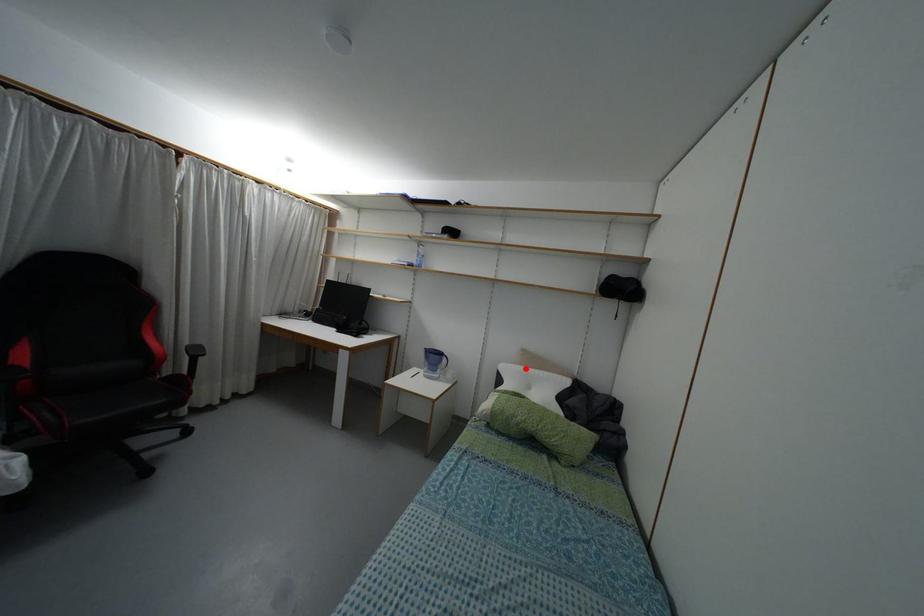
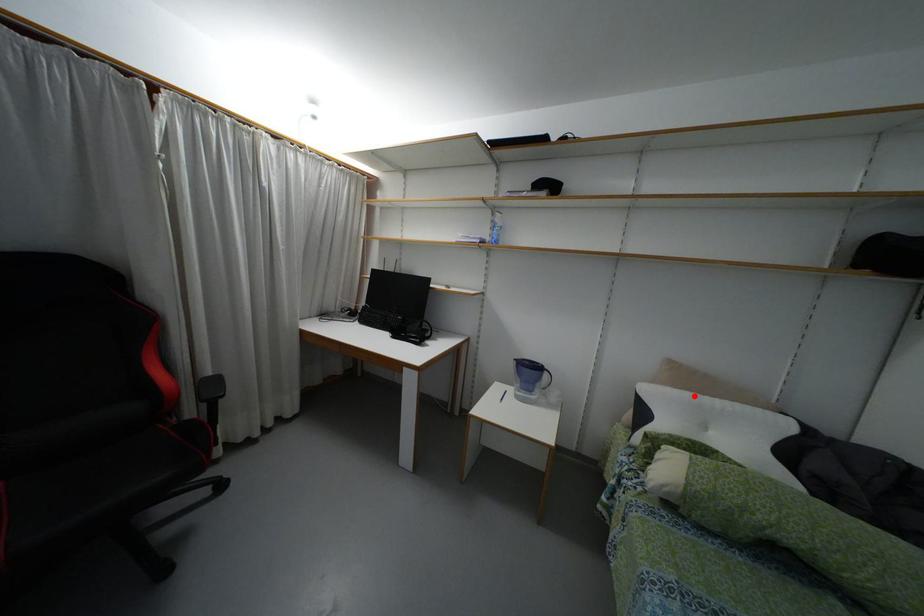
I am providing you with two images of the same scene from different viewpoints. A red point is marked on the first image and another point is marked on the second image. Does the point marked in image1 correspond to the same location as the one in image2?

Yes